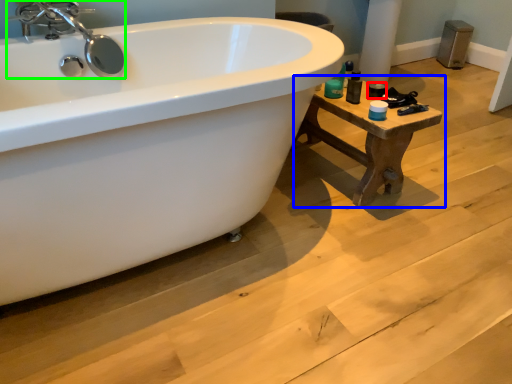
Question: Based on their relative distances, which object is nearer to toiletry (highlighted by a red box)? Choose from table (highlighted by a blue box) and tap (highlighted by a green box).

Choices:
 (A) table
 (B) tap

Answer: (A)